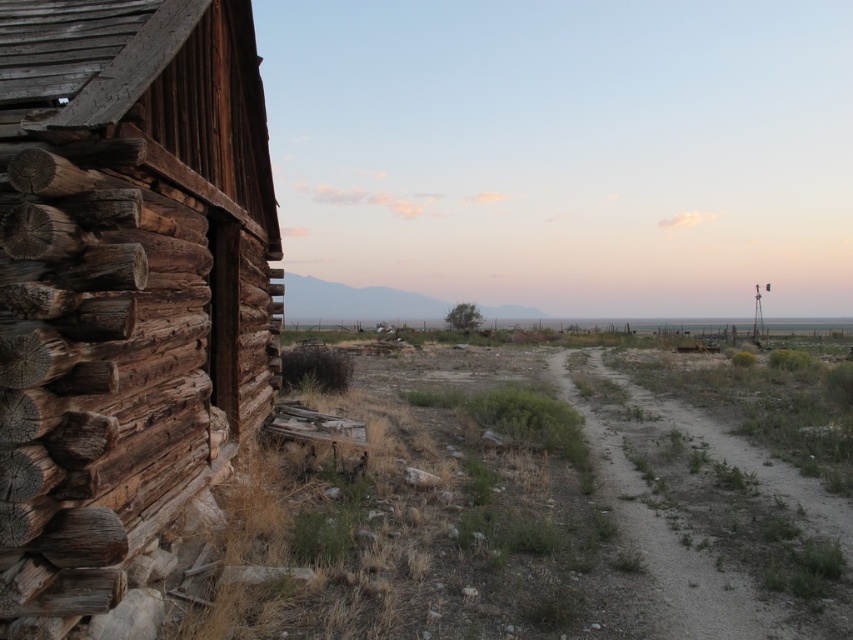
Consider the image. Can you confirm if weathered wood log cabin at left is thinner than dusty gravel trail at center-right?

Indeed, weathered wood log cabin at left has a lesser width compared to dusty gravel trail at center-right.

Who is more forward, [144,515] or [598,378]?

Positioned in front is point [144,515].

This screenshot has height=640, width=853. Find the location of `weathered wood log cabin at left`. weathered wood log cabin at left is located at coordinates (123, 284).